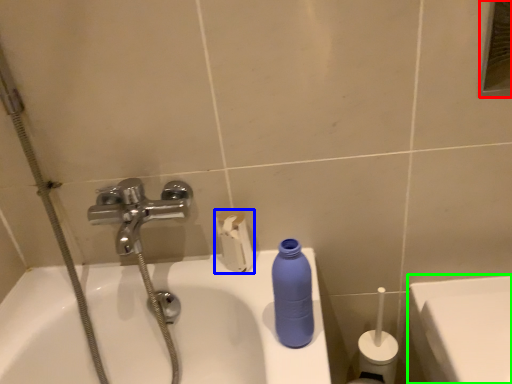
Question: Which is nearer to the mirror (highlighted by a red box)? toilet paper (highlighted by a blue box) or porcelain (highlighted by a green box).

Choices:
 (A) toilet paper
 (B) porcelain

Answer: (B)